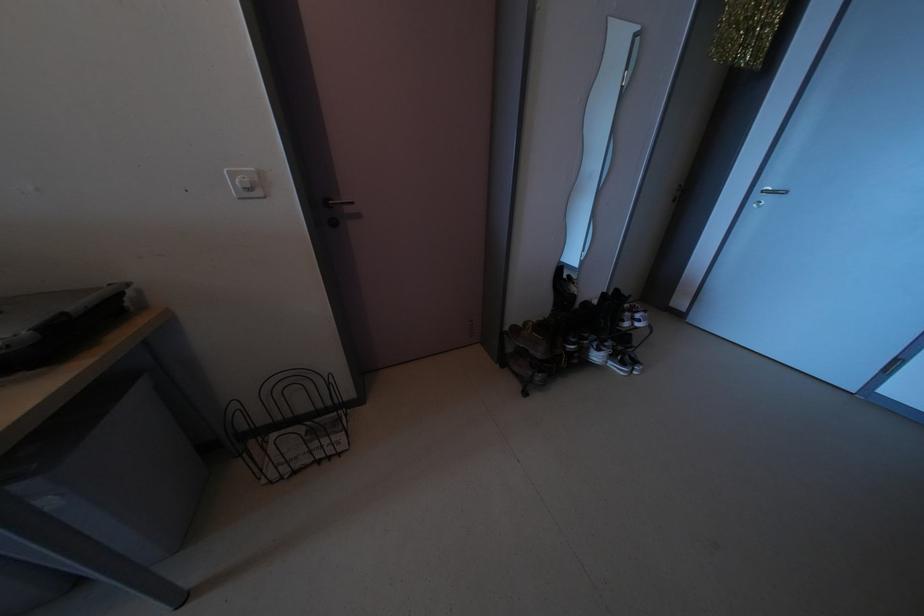
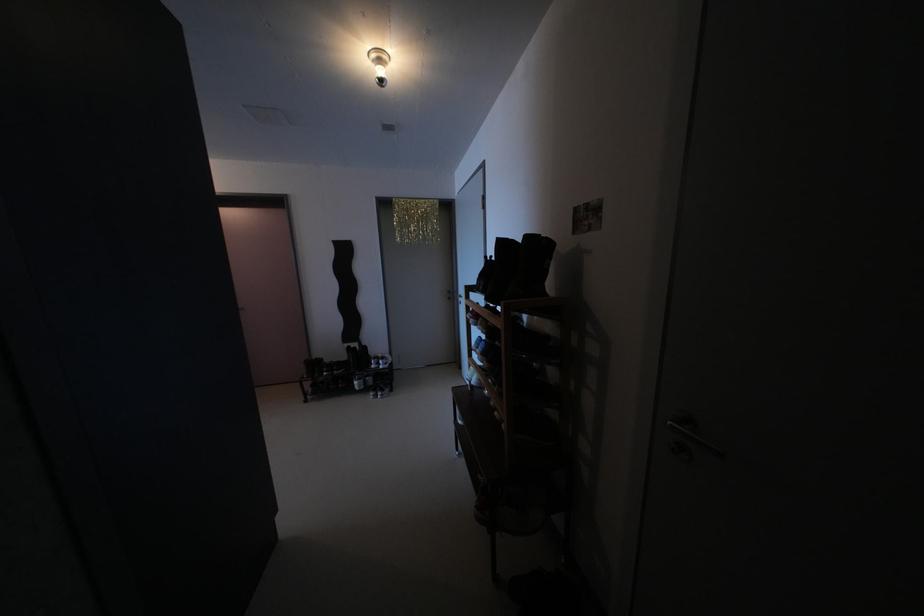
Which direction would the cameraman need to move to produce the second image?

The cameraman moved toward right, backward.